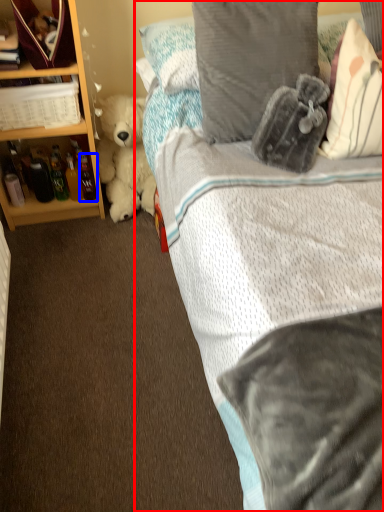
Question: Which of the following is the closest to the observer, bed (highlighted by a red box) or bottle (highlighted by a blue box)?

Choices:
 (A) bed
 (B) bottle

Answer: (A)